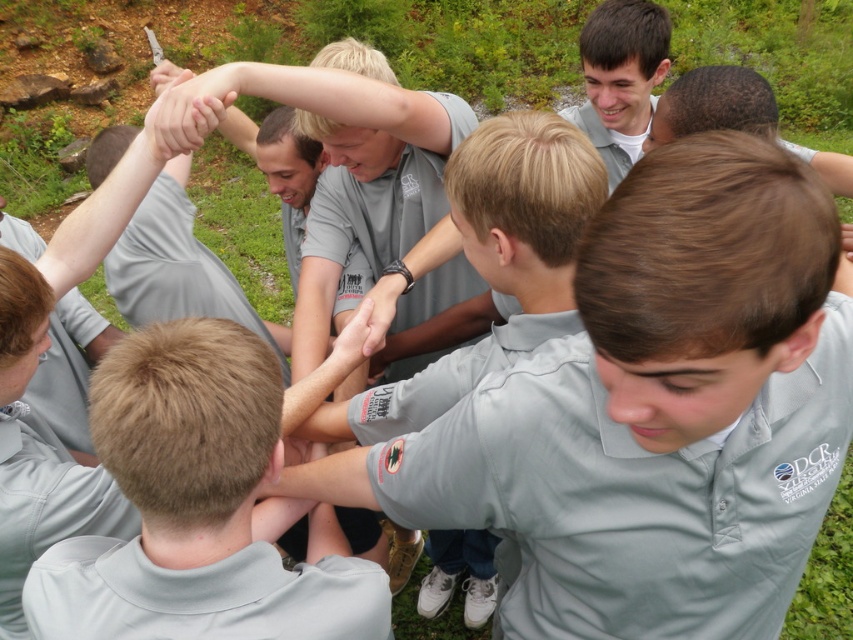
Question: Observing the image, what is the correct spatial positioning of light brown hair at center in reference to matte gray hand at center?

Choices:
 (A) above
 (B) below

Answer: (B)

Question: Which object is positioned closest to the light brown hair at center?

Choices:
 (A) matte gray shirt at center
 (B) matte gray hand at center

Answer: (A)

Question: Is matte gray shirt at center bigger than matte gray hand at center?

Choices:
 (A) yes
 (B) no

Answer: (A)

Question: Estimate the real-world distances between objects in this image. Which object is closer to the light brown hair at center?

Choices:
 (A) matte gray hand at center
 (B) matte gray shirt at center

Answer: (B)

Question: Is matte gray shirt at center closer to the viewer compared to light brown hair at center?

Choices:
 (A) no
 (B) yes

Answer: (B)

Question: Which point is closer to the camera?

Choices:
 (A) matte gray shirt at center
 (B) light brown hair at center

Answer: (A)